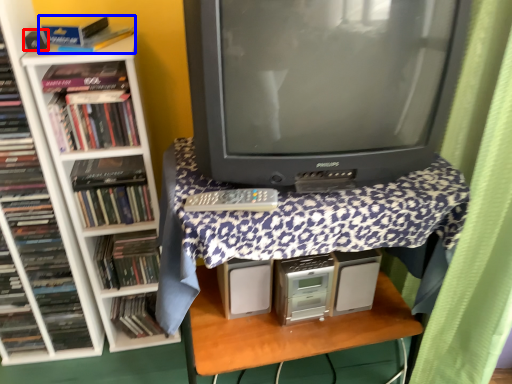
Question: Which object is closer to the camera taking this photo, speaker (highlighted by a red box) or book (highlighted by a blue box)?

Choices:
 (A) speaker
 (B) book

Answer: (B)